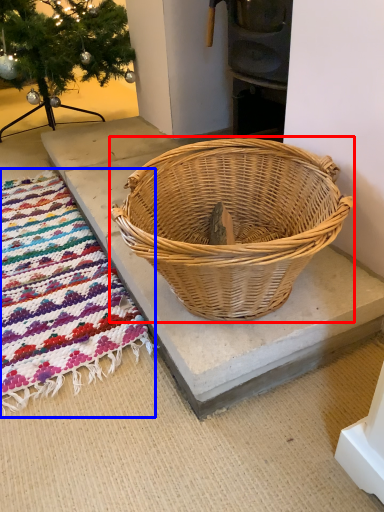
Question: Which object appears farthest to the camera in this image, picnic basket (highlighted by a red box) or mat (highlighted by a blue box)?

Choices:
 (A) picnic basket
 (B) mat

Answer: (B)